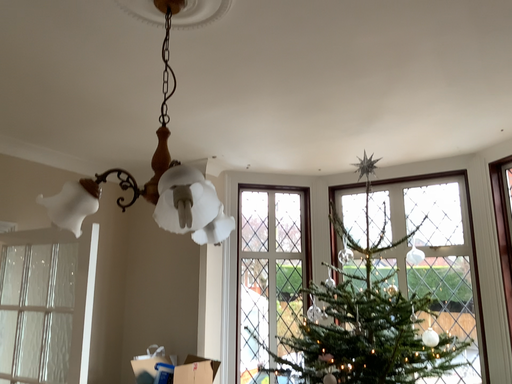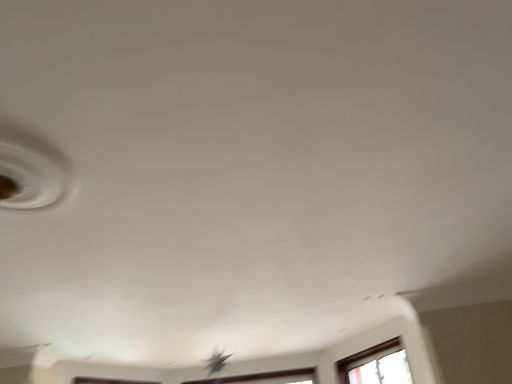
Question: Which way did the camera rotate in the video?

Choices:
 (A) rotated right
 (B) rotated left

Answer: (A)